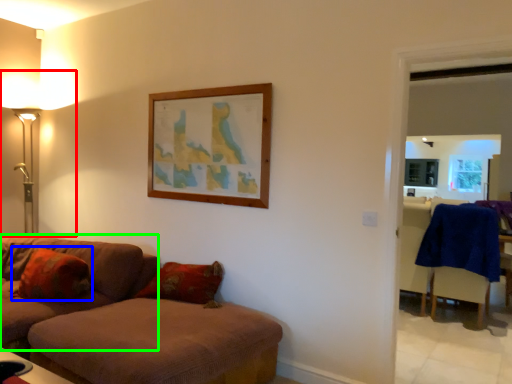
Question: Which object is the farthest from table lamp (highlighted by a red box)? Choose among these: pillow (highlighted by a blue box) or studio couch (highlighted by a green box).

Choices:
 (A) pillow
 (B) studio couch

Answer: (A)